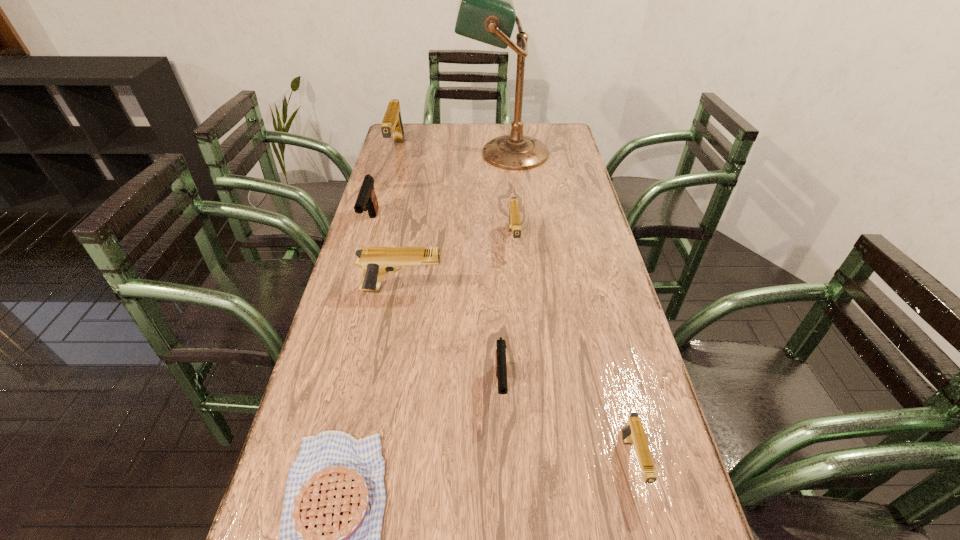
This screenshot has width=960, height=540. In order to click on vacant space positioned 0.200m at the barrel of the third biggest tan pistol in this screenshot , I will do (519, 312).

Identify the location of free space located 0.170m at the barrel of the smaller black pistol. (505, 501).

Where is `vacant area located at the barrel of the smallest tan pistol`? This screenshot has width=960, height=540. vacant area located at the barrel of the smallest tan pistol is located at coordinates (650, 534).

Where is `table lamp positioned at the far edge`? table lamp positioned at the far edge is located at coordinates (486, 13).

What are the coordinates of `pistol present at the far edge` in the screenshot? It's located at (392, 123).

Where is `table lamp positioned at the right edge`? The height and width of the screenshot is (540, 960). table lamp positioned at the right edge is located at coordinates (486, 13).

Locate an element on the screen. This screenshot has height=540, width=960. pistol positioned at the right edge is located at coordinates (633, 433).

The image size is (960, 540). What are the coordinates of `object at the far left corner` in the screenshot? It's located at (392, 123).

Locate an element on the screen. This screenshot has height=540, width=960. object situated at the far right corner is located at coordinates (486, 13).

You are a GUI agent. You are given a task and a screenshot of the screen. Output one action in this format:
    pyautogui.click(x=<x>, y=<y>)
    Task: Click on the vacant space at the far edge of the desktop
    The height and width of the screenshot is (540, 960).
    Given the screenshot: What is the action you would take?
    pyautogui.click(x=450, y=128)